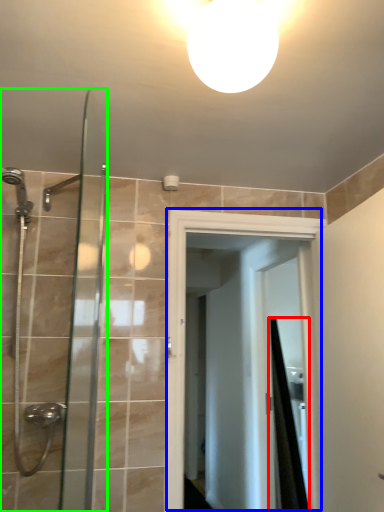
Question: Considering the real-world distances, which object is closest to shower curtain (highlighted by a red box)? screen door (highlighted by a blue box) or shower door (highlighted by a green box).

Choices:
 (A) screen door
 (B) shower door

Answer: (A)